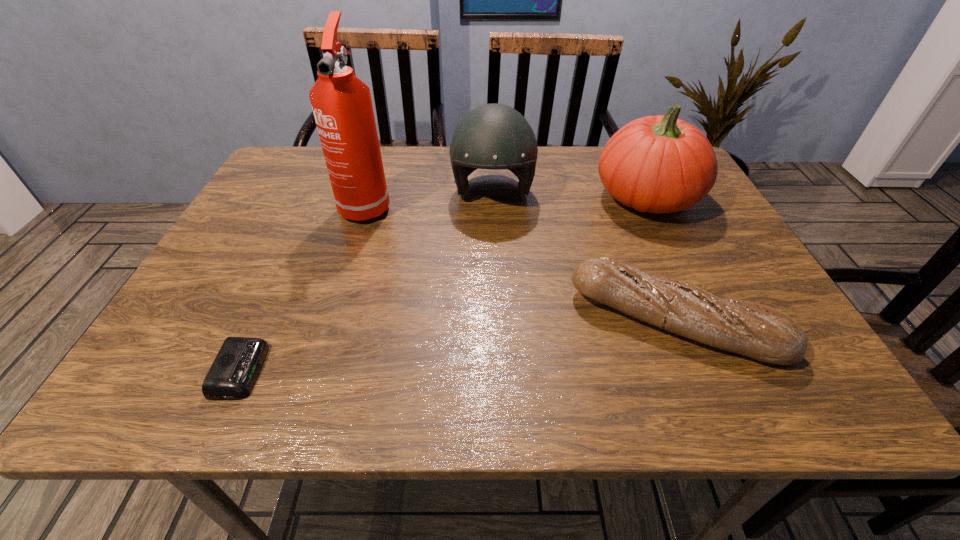
Locate which object ranks in proximity to the baguet. Please provide its 2D coordinates. Your answer should be formatted as a tuple, i.e. [(x, y)], where the tuple contains the x and y coordinates of a point satisfying the conditions above.

[(658, 164)]

At what (x,y) coordinates should I click in order to perform the action: click on vacant region that satisfies the following two spatial constraints: 1. at the nozzle of the fire extinguisher; 2. on the right side of the baguet. Please return your answer as a coordinate pair (x, y). This screenshot has width=960, height=540. Looking at the image, I should click on (328, 321).

Locate an element on the screen. The width and height of the screenshot is (960, 540). vacant region that satisfies the following two spatial constraints: 1. at the nozzle of the fire extinguisher; 2. on the left side of the fourth tallest object is located at coordinates (328, 321).

This screenshot has width=960, height=540. Identify the location of vacant area in the image that satisfies the following two spatial constraints: 1. at the nozzle of the fourth object from right to left; 2. on the left side of the fourth tallest object. (328, 321).

You are a GUI agent. You are given a task and a screenshot of the screen. Output one action in this format:
    pyautogui.click(x=<x>, y=<y>)
    Task: Click on the free location that satisfies the following two spatial constraints: 1. at the nozzle of the fire extinguisher; 2. on the display of the shortest object
    The image size is (960, 540).
    Given the screenshot: What is the action you would take?
    pyautogui.click(x=313, y=370)

The image size is (960, 540). I want to click on free space that satisfies the following two spatial constraints: 1. at the face opening of the baguet; 2. on the left side of the football helmet, so click(497, 321).